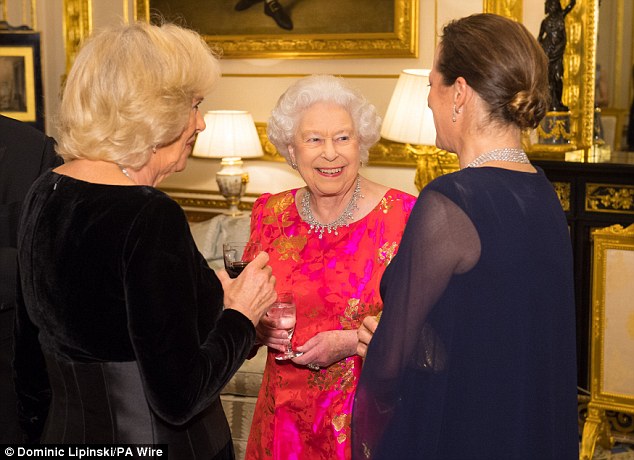
Find the location of a particular element. The width and height of the screenshot is (634, 460). mirror is located at coordinates (598, 83).